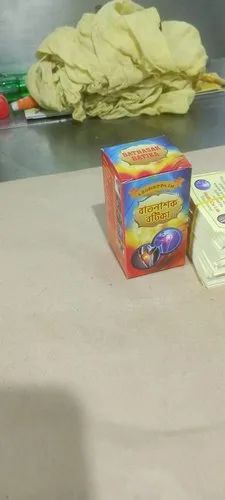
Find the location of a particular element. This screenshot has height=500, width=225. wadded offwhite cloth is located at coordinates (94, 65).